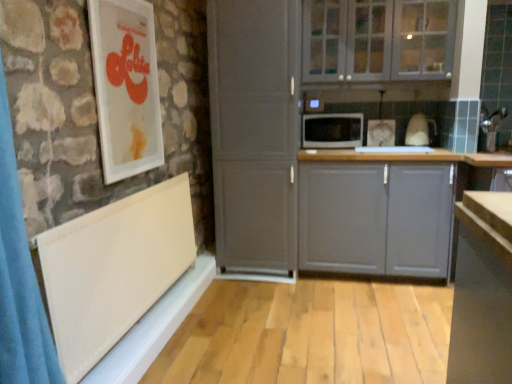
You are a GUI agent. You are given a task and a screenshot of the screen. Output one action in this format:
    pyautogui.click(x=<x>, y=<y>)
    Task: Click on the black matte microwave at center
    The image size is (512, 384).
    Given the screenshot: What is the action you would take?
    pyautogui.click(x=332, y=130)

This screenshot has height=384, width=512. I want to click on white glossy picture frame at upper left, so click(x=126, y=87).

Based on the photo, what is the approximate height of white textured window sill at lower left?

It is 17.73 centimeters.

What do you see at coordinates (154, 327) in the screenshot? This screenshot has height=384, width=512. I see `white textured window sill at lower left` at bounding box center [154, 327].

At what (x,y) coordinates should I click in order to perform the action: click on white matte cabinet at center. Please return your answer as a coordinate pair (x, y). Image resolution: width=512 pixels, height=384 pixels. Looking at the image, I should click on (254, 132).

How different are the orientations of gray matte cabinet at center, which appears as the second cabinetry when viewed from the top, and white glossy picture frame at upper left in degrees?

There is a 88-degree angle between the facing directions of gray matte cabinet at center, which appears as the second cabinetry when viewed from the top, and white glossy picture frame at upper left.

Which object is thinner, gray matte cabinet at center, arranged as the 1th cabinetry when ordered from the bottom, or white glossy picture frame at upper left?

white glossy picture frame at upper left.

Is gray matte cabinet at center, which appears as the second cabinetry when viewed from the top, spatially inside white glossy picture frame at upper left, or outside of it?

gray matte cabinet at center, which appears as the second cabinetry when viewed from the top, is outside white glossy picture frame at upper left.

Is gray matte cabinet at center, arranged as the 1th cabinetry when ordered from the bottom, not near white glossy picture frame at upper left?

Yes.

How many degrees apart are the facing directions of white textured radiator at lower left and white matte cabinet at center?

88.2 degrees.

Is white textured radiator at lower left bigger than white matte cabinet at center?

Incorrect, white textured radiator at lower left is not larger than white matte cabinet at center.

In the image, is white textured radiator at lower left positioned in front of or behind white matte cabinet at center?

In the image, white textured radiator at lower left appears in front of white matte cabinet at center.

Does white textured radiator at lower left have a greater height compared to white matte cabinet at center?

Incorrect, the height of white textured radiator at lower left is not larger of that of white matte cabinet at center.

Between point (324, 166) and point (121, 373), which one is positioned behind?

Point (324, 166)

From the image's perspective, is gray matte cabinet at center, arranged as the 1th cabinetry when ordered from the bottom, over white textured window sill at lower left?

Correct, gray matte cabinet at center, arranged as the 1th cabinetry when ordered from the bottom, appears higher than white textured window sill at lower left in the image.

Does gray matte cabinet at center, arranged as the 1th cabinetry when ordered from the bottom, have a lesser height compared to white textured window sill at lower left?

No, gray matte cabinet at center, arranged as the 1th cabinetry when ordered from the bottom, is not shorter than white textured window sill at lower left.

How different are the orientations of gray matte cabinet at center, which appears as the second cabinetry when viewed from the top, and white textured window sill at lower left in degrees?

The angle between the facing direction of gray matte cabinet at center, which appears as the second cabinetry when viewed from the top, and the facing direction of white textured window sill at lower left is 89.1 degrees.

From a real-world perspective, is white glass cabinets at upper center, the second cabinetry positioned from the bottom, under black matte microwave at center?

No, from a real-world perspective, white glass cabinets at upper center, the second cabinetry positioned from the bottom, is not below black matte microwave at center.

Based on the photo, who is bigger, white glass cabinets at upper center, the second cabinetry positioned from the bottom, or black matte microwave at center?

white glass cabinets at upper center, the second cabinetry positioned from the bottom, is bigger.

In the image, is white glass cabinets at upper center, which appears as the 1th cabinetry when viewed from the top, positioned in front of or behind black matte microwave at center?

In the image, white glass cabinets at upper center, which appears as the 1th cabinetry when viewed from the top, appears in front of black matte microwave at center.

Is white glass cabinets at upper center, the second cabinetry positioned from the bottom, at the left side of black matte microwave at center?

In fact, white glass cabinets at upper center, the second cabinetry positioned from the bottom, is to the right of black matte microwave at center.

Can white glass cabinets at upper center, which appears as the 1th cabinetry when viewed from the top, be found inside gray matte cabinet at center, arranged as the 1th cabinetry when ordered from the bottom?

No, white glass cabinets at upper center, which appears as the 1th cabinetry when viewed from the top, is not inside gray matte cabinet at center, arranged as the 1th cabinetry when ordered from the bottom.

Consider the image. Are gray matte cabinet at center, arranged as the 1th cabinetry when ordered from the bottom, and white glass cabinets at upper center, the second cabinetry positioned from the bottom, far apart?

No, gray matte cabinet at center, arranged as the 1th cabinetry when ordered from the bottom, is not far away from white glass cabinets at upper center, the second cabinetry positioned from the bottom.

Consider the image. Considering the sizes of objects gray matte cabinet at center, arranged as the 1th cabinetry when ordered from the bottom, and white glass cabinets at upper center, the second cabinetry positioned from the bottom, in the image provided, who is wider, gray matte cabinet at center, arranged as the 1th cabinetry when ordered from the bottom, or white glass cabinets at upper center, the second cabinetry positioned from the bottom,?

gray matte cabinet at center, arranged as the 1th cabinetry when ordered from the bottom.

From a real-world perspective, between gray matte cabinet at center, which appears as the second cabinetry when viewed from the top, and white glass cabinets at upper center, the second cabinetry positioned from the bottom, who is vertically lower?

From a 3D spatial view, gray matte cabinet at center, which appears as the second cabinetry when viewed from the top, is below.

Looking at this image, can you confirm if white textured window sill at lower left is shorter than gray matte cabinet at center, arranged as the 1th cabinetry when ordered from the bottom?

Correct, white textured window sill at lower left is not as tall as gray matte cabinet at center, arranged as the 1th cabinetry when ordered from the bottom.

Is white textured window sill at lower left wider or thinner than gray matte cabinet at center, which appears as the second cabinetry when viewed from the top?

Considering their sizes, white textured window sill at lower left looks slimmer than gray matte cabinet at center, which appears as the second cabinetry when viewed from the top.

Is white textured window sill at lower left in front of or behind gray matte cabinet at center, which appears as the second cabinetry when viewed from the top, in the image?

white textured window sill at lower left is positioned closer to the viewer than gray matte cabinet at center, which appears as the second cabinetry when viewed from the top.

Where is `microwave oven lying on the right of white textured radiator at lower left`? microwave oven lying on the right of white textured radiator at lower left is located at coordinates (332, 130).

Is black matte microwave at center at the back of white textured radiator at lower left?

No, white textured radiator at lower left's orientation is not away from black matte microwave at center.

Considering the sizes of white textured radiator at lower left and black matte microwave at center in the image, is white textured radiator at lower left bigger or smaller than black matte microwave at center?

Clearly, white textured radiator at lower left is larger in size than black matte microwave at center.

Does white textured radiator at lower left come behind black matte microwave at center?

That is False.

Where is `cabinetry that appears below the white glossy picture frame at upper left (from the image's perspective)`? The width and height of the screenshot is (512, 384). cabinetry that appears below the white glossy picture frame at upper left (from the image's perspective) is located at coordinates (376, 218).

Identify the location of screen door above the white textured radiator at lower left (from a real-world perspective). This screenshot has height=384, width=512. (254, 132).

Looking at the image, which one is located closer to white glossy picture frame at upper left, white matte cabinet at center or white textured window sill at lower left?

white matte cabinet at center.

Which object lies further to the anchor point white textured radiator at lower left, white textured window sill at lower left or gray matte cabinet at center, arranged as the 1th cabinetry when ordered from the bottom?

gray matte cabinet at center, arranged as the 1th cabinetry when ordered from the bottom, lies further to white textured radiator at lower left than the other object.

Considering their positions, is white textured window sill at lower left positioned further to white matte cabinet at center than gray matte cabinet at center, which appears as the second cabinetry when viewed from the top?

white textured window sill at lower left is positioned further to the anchor white matte cabinet at center.

Based on their spatial positions, is white glossy picture frame at upper left or white glass cabinets at upper center, which appears as the 1th cabinetry when viewed from the top, further from white textured radiator at lower left?

Based on the image, white glass cabinets at upper center, which appears as the 1th cabinetry when viewed from the top, appears to be further to white textured radiator at lower left.

Based on their spatial positions, is gray matte cabinet at center, arranged as the 1th cabinetry when ordered from the bottom, or white textured window sill at lower left further from white matte cabinet at center?

white textured window sill at lower left lies further to white matte cabinet at center than the other object.

Looking at the image, which one is located closer to gray matte cabinet at center, arranged as the 1th cabinetry when ordered from the bottom, white glossy picture frame at upper left or white textured window sill at lower left?

white textured window sill at lower left is positioned closer to the anchor gray matte cabinet at center, arranged as the 1th cabinetry when ordered from the bottom.

When comparing their distances from black matte microwave at center, does white matte cabinet at center or white glossy picture frame at upper left seem further?

Based on the image, white glossy picture frame at upper left appears to be further to black matte microwave at center.

Estimate the real-world distances between objects in this image. Which object is further from white textured radiator at lower left, black matte microwave at center or white glossy picture frame at upper left?

Based on the image, black matte microwave at center appears to be further to white textured radiator at lower left.

Locate an element on the screen. The height and width of the screenshot is (384, 512). screen door between white glass cabinets at upper center, the second cabinetry positioned from the bottom, and white textured window sill at lower left vertically is located at coordinates (254, 132).

Locate an element on the screen. Image resolution: width=512 pixels, height=384 pixels. window sill between white textured radiator at lower left and black matte microwave at center along the z-axis is located at coordinates 154,327.

Where is `microwave oven situated between white matte cabinet at center and white glass cabinets at upper center, the second cabinetry positioned from the bottom, from left to right`? This screenshot has height=384, width=512. microwave oven situated between white matte cabinet at center and white glass cabinets at upper center, the second cabinetry positioned from the bottom, from left to right is located at coordinates (332, 130).

Find the location of a particular element. This screenshot has height=384, width=512. window sill between white textured radiator at lower left and white matte cabinet at center in the front-back direction is located at coordinates (154, 327).